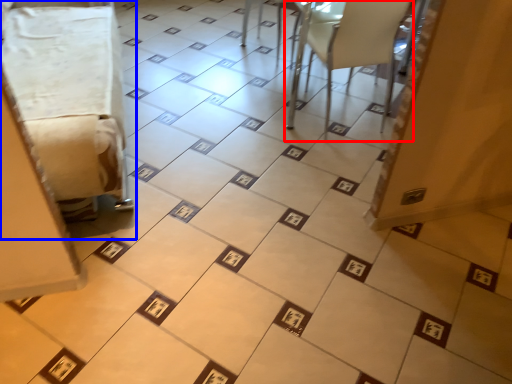
Question: Which object appears farthest to the camera in this image, furniture (highlighted by a red box) or furniture (highlighted by a blue box)?

Choices:
 (A) furniture
 (B) furniture

Answer: (A)